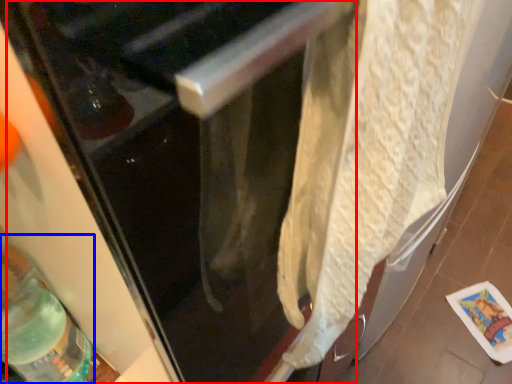
Question: Which object appears closest to the camera in this image, screen door (highlighted by a red box) or bottle (highlighted by a blue box)?

Choices:
 (A) screen door
 (B) bottle

Answer: (A)